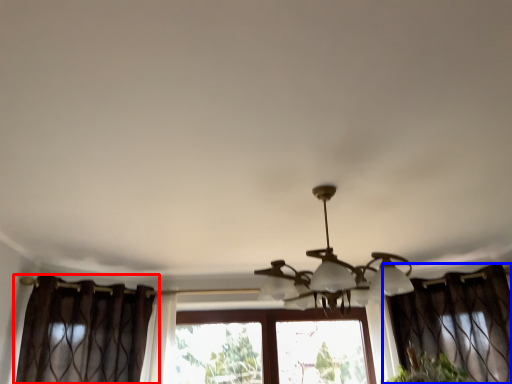
Question: Which object is closer to the camera taking this photo, curtain (highlighted by a red box) or curtain (highlighted by a blue box)?

Choices:
 (A) curtain
 (B) curtain

Answer: (A)